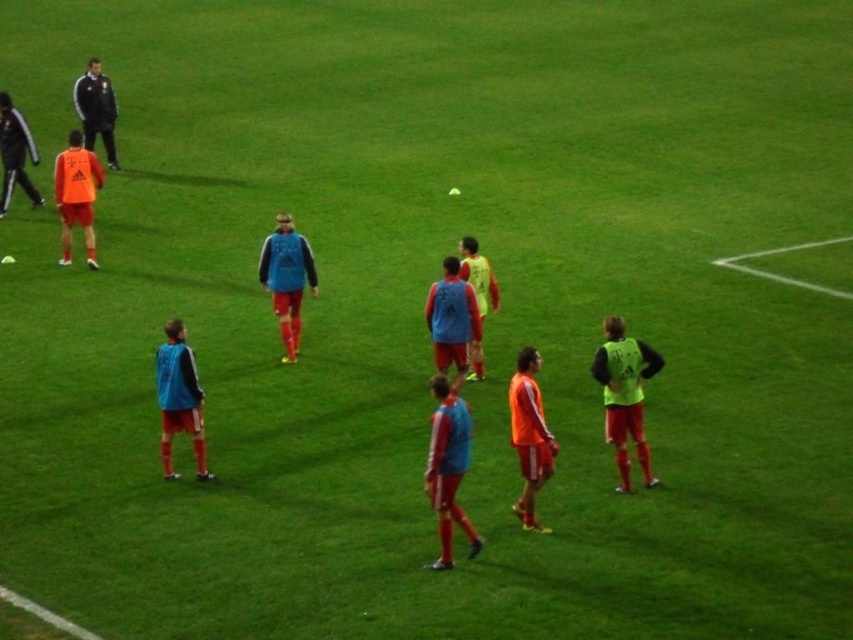
Which of these two, orange jersey at left or dark gray smooth jacket at upper left, stands taller?

orange jersey at left

Does point (74, 195) come farther from viewer compared to point (102, 96)?

No, it is not.

Identify the location of orange jersey at left. The height and width of the screenshot is (640, 853). (76, 195).

This screenshot has height=640, width=853. What are the coordinates of `orange jersey at left` in the screenshot? It's located at (76, 195).

What do you see at coordinates (286, 280) in the screenshot?
I see `blue fleece jacket at center` at bounding box center [286, 280].

Locate an element on the screen. This screenshot has height=640, width=853. blue fleece jacket at center is located at coordinates (286, 280).

Is blue fleece jacket at center taller than dark gray smooth jacket at upper left?

Yes, blue fleece jacket at center is taller than dark gray smooth jacket at upper left.

The width and height of the screenshot is (853, 640). What do you see at coordinates (286, 280) in the screenshot? I see `blue fleece jacket at center` at bounding box center [286, 280].

You are a GUI agent. You are given a task and a screenshot of the screen. Output one action in this format:
    pyautogui.click(x=<x>, y=<y>)
    Task: Click on the blue fleece jacket at center
    This screenshot has height=640, width=853.
    Given the screenshot: What is the action you would take?
    pyautogui.click(x=286, y=280)